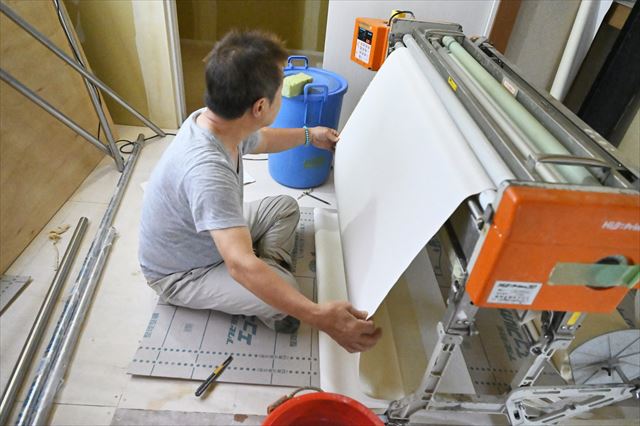
This screenshot has height=426, width=640. Find the location of `doorway`. doorway is located at coordinates (161, 33), (337, 25).